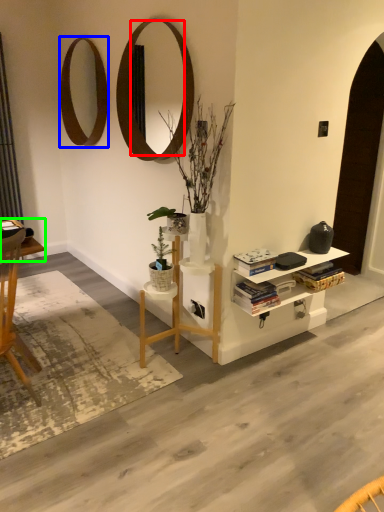
Question: Based on their relative distances, which object is nearer to mirror (highlighted by a red box)? Choose from mirror (highlighted by a blue box) and desk (highlighted by a green box).

Choices:
 (A) mirror
 (B) desk

Answer: (A)